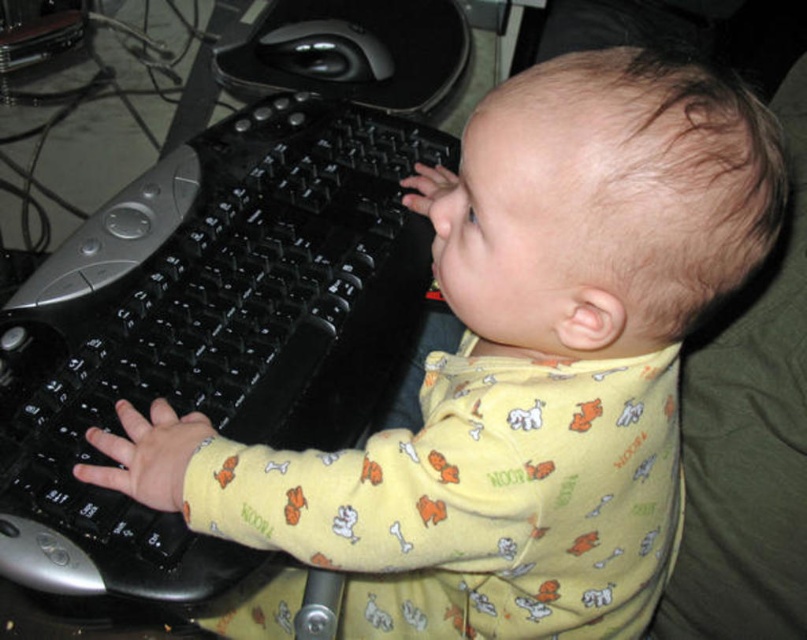
Which of these two, black plastic keyboard at left or black glossy mouse at upper center, stands taller?

With more height is black plastic keyboard at left.

Does black plastic keyboard at left have a larger size compared to black glossy mouse at upper center?

Yes.

This screenshot has height=640, width=807. I want to click on black plastic keyboard at left, so click(210, 330).